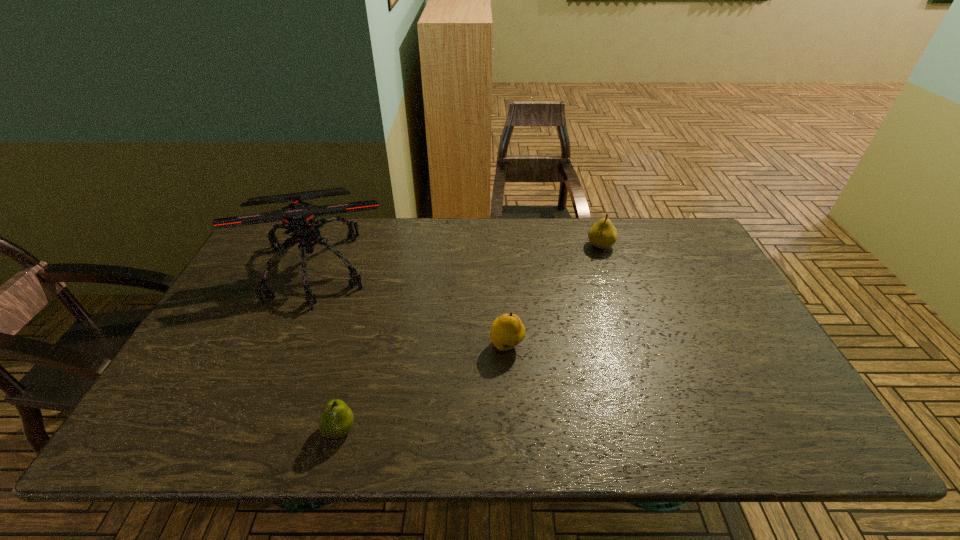
Image resolution: width=960 pixels, height=540 pixels. Identify the location of vacant region at the far right corner of the desktop. (649, 232).

In the image, there is a desktop. Find the location of `vacant space at the near right corner`. vacant space at the near right corner is located at coordinates (756, 441).

This screenshot has height=540, width=960. Identify the location of vacant region between the rightmost pear and the second nearest pear. (554, 296).

Locate an element on the screen. The width and height of the screenshot is (960, 540). free space between the rightmost pear and the drone is located at coordinates (458, 256).

Where is `vacant area that lies between the second pear from right to left and the nearest pear`? The height and width of the screenshot is (540, 960). vacant area that lies between the second pear from right to left and the nearest pear is located at coordinates (423, 388).

Find the location of a particular element. This screenshot has width=960, height=540. free space between the drone and the rightmost object is located at coordinates (x=458, y=256).

The width and height of the screenshot is (960, 540). In order to click on empty location between the rightmost object and the leftmost pear in this screenshot , I will do `click(470, 338)`.

I want to click on empty space that is in between the second nearest pear and the nearest object, so click(423, 388).

Where is `free space between the nearest pear and the second nearest pear`? free space between the nearest pear and the second nearest pear is located at coordinates (423, 388).

You are a GUI agent. You are given a task and a screenshot of the screen. Output one action in this format:
    pyautogui.click(x=<x>, y=<y>)
    Task: Click on the unoccupied position between the second nearest pear and the rightmost object
    
    Given the screenshot: What is the action you would take?
    pyautogui.click(x=554, y=296)